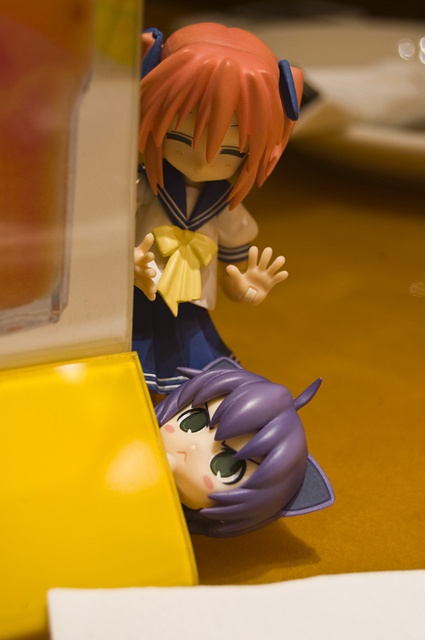
Question: Which of the following is the closest to the observer?

Choices:
 (A) (295, 417)
 (B) (155, 381)

Answer: (A)

Question: Does satin yellow ribbon at center have a smaller size compared to purple glossy figurine at lower center?

Choices:
 (A) no
 (B) yes

Answer: (A)

Question: Which of the following is the closest to the observer?

Choices:
 (A) purple glossy figurine at lower center
 (B) satin yellow ribbon at center

Answer: (A)

Question: Which point is farther from the camera taking this photo?

Choices:
 (A) (235, 438)
 (B) (167, 380)

Answer: (B)

Question: Is satin yellow ribbon at center to the left of purple glossy figurine at lower center from the viewer's perspective?

Choices:
 (A) yes
 (B) no

Answer: (A)

Question: Where is satin yellow ribbon at center located in relation to purple glossy figurine at lower center in the image?

Choices:
 (A) right
 (B) left

Answer: (B)